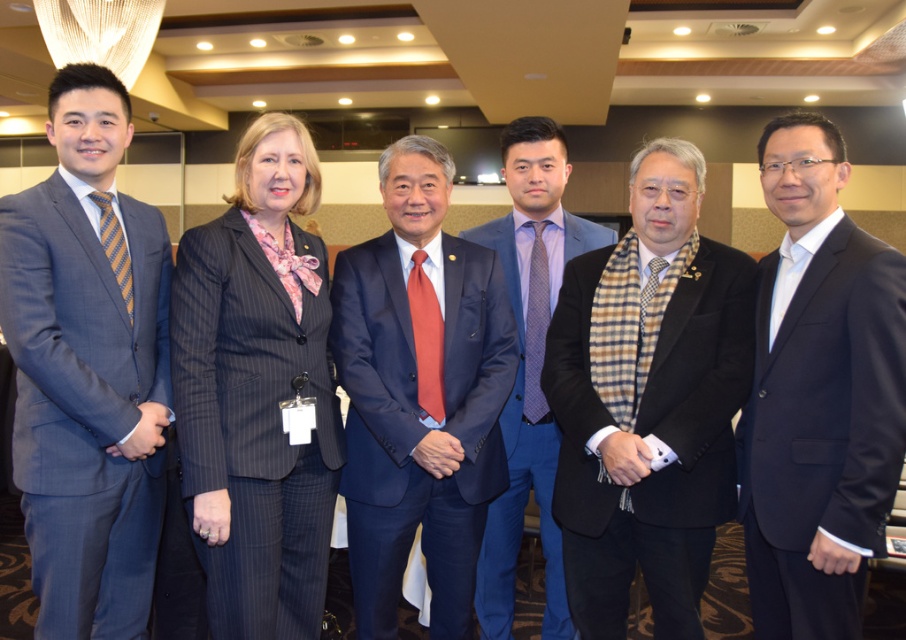
Is point (361, 561) in front of point (599, 244)?

That is True.

Where is `navy blue suit at center`? navy blue suit at center is located at coordinates (418, 426).

This screenshot has width=906, height=640. Identify the location of navy blue suit at center. (418, 426).

Does navy blue wool suit at center have a greater width compared to dark blue pinstripe suit at center?

No, navy blue wool suit at center is not wider than dark blue pinstripe suit at center.

Which is behind, point (787, 365) or point (232, 483)?

Positioned behind is point (232, 483).

In order to click on navy blue wool suit at center in this screenshot , I will do `click(821, 426)`.

Is navy blue suit at center below black woolen suit at center?

Yes, navy blue suit at center is below black woolen suit at center.

Does point (381, 244) come closer to viewer compared to point (654, 493)?

No, (381, 244) is behind (654, 493).

This screenshot has width=906, height=640. Describe the element at coordinates (418, 426) in the screenshot. I see `navy blue suit at center` at that location.

This screenshot has height=640, width=906. Find the location of `navy blue suit at center`. navy blue suit at center is located at coordinates (418, 426).